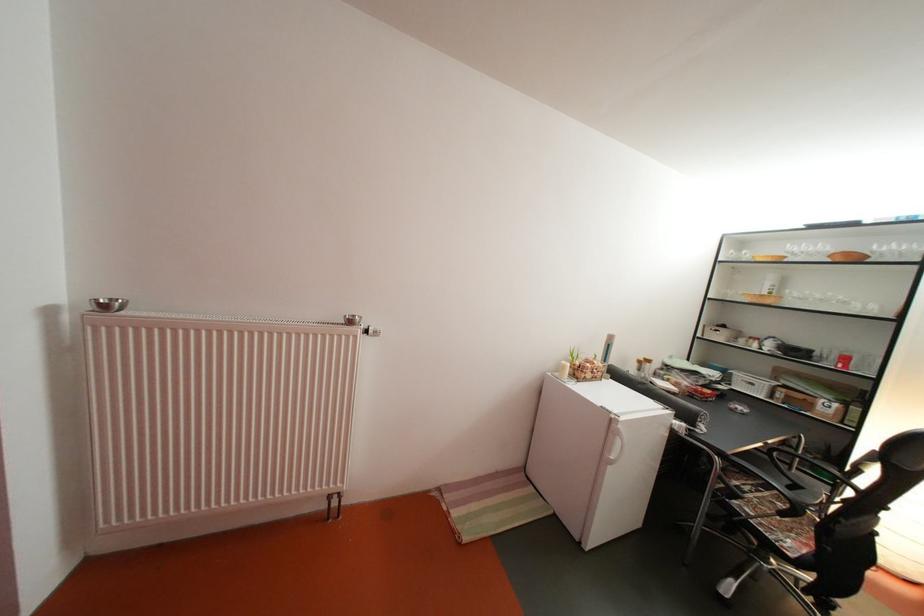
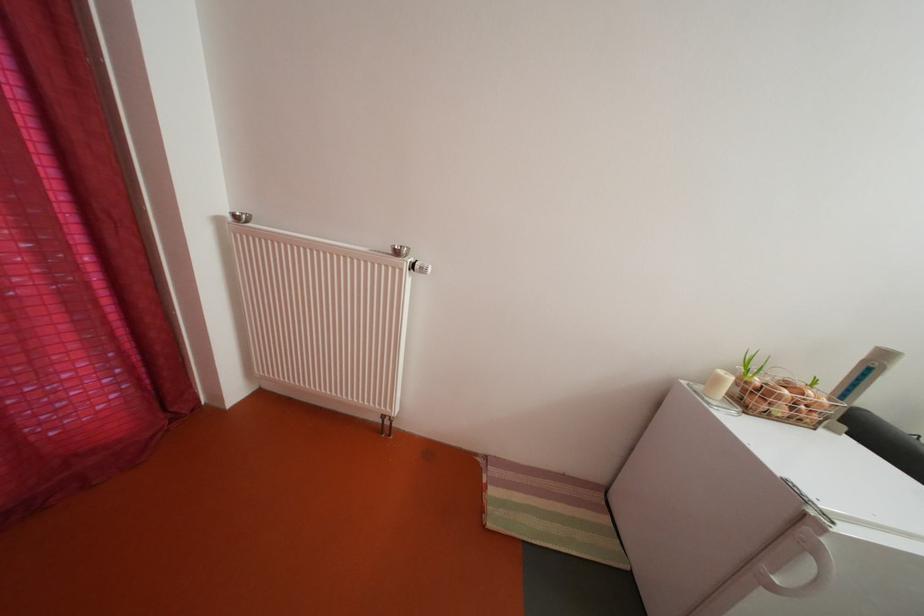
Find the pixel in the second image that matches [600,382] in the first image.

(792, 416)